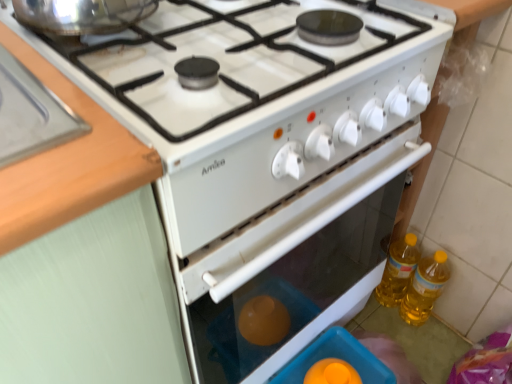
Where is `yellow translucent bottle at right, which appears as the 1th bottle when viewed from the left`? yellow translucent bottle at right, which appears as the 1th bottle when viewed from the left is located at coordinates (398, 271).

Where is `wooden at left`? wooden at left is located at coordinates (70, 166).

This screenshot has height=384, width=512. What do you see at coordinates (336, 357) in the screenshot?
I see `translucent plastic container at lower center` at bounding box center [336, 357].

Locate an element on the screen. yellow translucent bottle at right, which appears as the 1th bottle when viewed from the left is located at coordinates (398, 271).

From the image's perspective, is yellow translucent bottle at lower right, acting as the second bottle starting from the left, beneath translucent plastic container at lower center?

No.

The width and height of the screenshot is (512, 384). I want to click on the 1st bottle behind the translucent plastic container at lower center, counting from the anchor's position, so click(x=424, y=288).

Is yellow translucent bottle at lower right, acting as the first bottle starting from the right, to the right of translucent plastic container at lower center from the viewer's perspective?

Yes.

Based on the photo, which object is wider, wooden at left or translucent plastic container at lower center?

Wider between the two is wooden at left.

Is wooden at left positioned in front of translucent plastic container at lower center?

Yes, it is in front of translucent plastic container at lower center.

Considering the positions of objects wooden at left and translucent plastic container at lower center in the image provided, who is more to the left, wooden at left or translucent plastic container at lower center?

From the viewer's perspective, wooden at left appears more on the left side.

How far apart are yellow translucent bottle at lower right, acting as the second bottle starting from the left, and yellow translucent bottle at right, which appears as the 1th bottle when viewed from the left?

2.04 inches.

Image resolution: width=512 pixels, height=384 pixels. In order to click on bottle below the yellow translucent bottle at lower right, acting as the first bottle starting from the right (from a real-world perspective) in this screenshot , I will do [398, 271].

Is point (407, 292) behind point (394, 269)?

Yes, it is behind point (394, 269).

Is yellow translucent bottle at lower right, acting as the second bottle starting from the left, placed right next to yellow translucent bottle at right, which appears as the 1th bottle when viewed from the left?

Yes, yellow translucent bottle at lower right, acting as the second bottle starting from the left, is right next to yellow translucent bottle at right, which appears as the 1th bottle when viewed from the left, and making contact.

In the image, is translucent plastic container at lower center positioned in front of or behind yellow translucent bottle at lower right, acting as the first bottle starting from the right?

In the image, translucent plastic container at lower center appears in front of yellow translucent bottle at lower right, acting as the first bottle starting from the right.

Does point (354, 352) come farther from viewer compared to point (437, 266)?

No, it is in front of (437, 266).

Considering the relative positions of translucent plastic container at lower center and yellow translucent bottle at lower right, acting as the first bottle starting from the right, in the image provided, is translucent plastic container at lower center to the left of yellow translucent bottle at lower right, acting as the first bottle starting from the right, from the viewer's perspective?

Correct, you'll find translucent plastic container at lower center to the left of yellow translucent bottle at lower right, acting as the first bottle starting from the right.

Does yellow translucent bottle at right, arranged as the second bottle when viewed from the right, have a smaller size compared to wooden at left?

Indeed, yellow translucent bottle at right, arranged as the second bottle when viewed from the right, has a smaller size compared to wooden at left.

Considering the relative sizes of yellow translucent bottle at right, which appears as the 1th bottle when viewed from the left, and wooden at left in the image provided, is yellow translucent bottle at right, which appears as the 1th bottle when viewed from the left, taller than wooden at left?

Yes, yellow translucent bottle at right, which appears as the 1th bottle when viewed from the left, is taller than wooden at left.

Looking at this image, from a real-world perspective, who is located lower, yellow translucent bottle at right, arranged as the second bottle when viewed from the right, or wooden at left?

yellow translucent bottle at right, arranged as the second bottle when viewed from the right.

From the image's perspective, relative to wooden at left, is translucent plastic container at lower center above or below?

Clearly, from the image's perspective, translucent plastic container at lower center is below wooden at left.

Considering the relative positions of translucent plastic container at lower center and wooden at left in the image provided, is translucent plastic container at lower center to the left or to the right of wooden at left?

From the image, it's evident that translucent plastic container at lower center is to the right of wooden at left.

Can you confirm if translucent plastic container at lower center is wider than wooden at left?

Incorrect, the width of translucent plastic container at lower center does not surpass that of wooden at left.

Does translucent plastic container at lower center lie in front of wooden at left?

No, it is behind wooden at left.

Find the location of `appliance in front of the yellow translucent bottle at right, arranged as the second bottle when viewed from the right`. appliance in front of the yellow translucent bottle at right, arranged as the second bottle when viewed from the right is located at coordinates (336, 357).

Is translucent plastic container at lower center inside or outside of yellow translucent bottle at right, which appears as the 1th bottle when viewed from the left?

translucent plastic container at lower center is not inside yellow translucent bottle at right, which appears as the 1th bottle when viewed from the left, it's outside.

Can you confirm if translucent plastic container at lower center is taller than yellow translucent bottle at right, which appears as the 1th bottle when viewed from the left?

No.

Looking at their sizes, would you say translucent plastic container at lower center is wider or thinner than yellow translucent bottle at right, arranged as the second bottle when viewed from the right?

translucent plastic container at lower center is wider than yellow translucent bottle at right, arranged as the second bottle when viewed from the right.

This screenshot has height=384, width=512. I want to click on appliance that appears in front of the yellow translucent bottle at lower right, acting as the second bottle starting from the left, so click(336, 357).

Locate an element on the screen. appliance lying below the wooden at left (from the image's perspective) is located at coordinates (336, 357).

When comparing their distances from yellow translucent bottle at right, which appears as the 1th bottle when viewed from the left, does wooden at left or yellow translucent bottle at lower right, acting as the first bottle starting from the right, seem closer?

yellow translucent bottle at lower right, acting as the first bottle starting from the right, is positioned closer to the anchor yellow translucent bottle at right, which appears as the 1th bottle when viewed from the left.

In the scene shown: Based on their spatial positions, is yellow translucent bottle at right, which appears as the 1th bottle when viewed from the left, or translucent plastic container at lower center closer to yellow translucent bottle at lower right, acting as the first bottle starting from the right?

The object closer to yellow translucent bottle at lower right, acting as the first bottle starting from the right, is yellow translucent bottle at right, which appears as the 1th bottle when viewed from the left.

From the image, which object appears to be farther from yellow translucent bottle at right, arranged as the second bottle when viewed from the right, wooden at left or translucent plastic container at lower center?

The object further to yellow translucent bottle at right, arranged as the second bottle when viewed from the right, is wooden at left.

From the image, which object appears to be farther from yellow translucent bottle at lower right, acting as the second bottle starting from the left, wooden at left or yellow translucent bottle at right, which appears as the 1th bottle when viewed from the left?

Based on the image, wooden at left appears to be further to yellow translucent bottle at lower right, acting as the second bottle starting from the left.

Looking at the image, which one is located closer to wooden at left, yellow translucent bottle at lower right, acting as the second bottle starting from the left, or yellow translucent bottle at right, arranged as the second bottle when viewed from the right?

yellow translucent bottle at right, arranged as the second bottle when viewed from the right, lies closer to wooden at left than the other object.

When comparing their distances from yellow translucent bottle at lower right, acting as the first bottle starting from the right, does yellow translucent bottle at right, which appears as the 1th bottle when viewed from the left, or wooden at left seem closer?

Based on the image, yellow translucent bottle at right, which appears as the 1th bottle when viewed from the left, appears to be nearer to yellow translucent bottle at lower right, acting as the first bottle starting from the right.

Estimate the real-world distances between objects in this image. Which object is further from translucent plastic container at lower center, yellow translucent bottle at right, arranged as the second bottle when viewed from the right, or wooden at left?

Among the two, wooden at left is located further to translucent plastic container at lower center.

Looking at the image, which one is located further to yellow translucent bottle at right, which appears as the 1th bottle when viewed from the left, translucent plastic container at lower center or yellow translucent bottle at lower right, acting as the second bottle starting from the left?

translucent plastic container at lower center lies further to yellow translucent bottle at right, which appears as the 1th bottle when viewed from the left, than the other object.

Locate an element on the screen. The width and height of the screenshot is (512, 384). appliance located between wooden at left and yellow translucent bottle at right, arranged as the second bottle when viewed from the right, in the left-right direction is located at coordinates (336, 357).

Image resolution: width=512 pixels, height=384 pixels. I want to click on bottle between translucent plastic container at lower center and yellow translucent bottle at right, which appears as the 1th bottle when viewed from the left, in the front-back direction, so click(x=424, y=288).

Locate an element on the screen. appliance situated between wooden at left and yellow translucent bottle at lower right, acting as the second bottle starting from the left, from left to right is located at coordinates (336, 357).

What are the coordinates of `bottle between wooden at left and yellow translucent bottle at lower right, acting as the first bottle starting from the right, from left to right` in the screenshot? It's located at (398, 271).